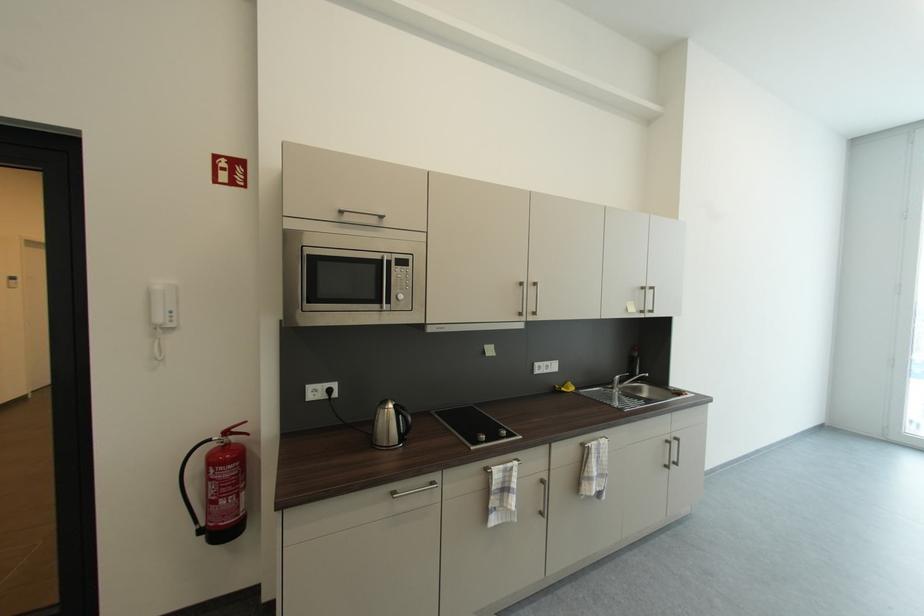
The image size is (924, 616). Describe the element at coordinates (399, 276) in the screenshot. I see `the microwave open button` at that location.